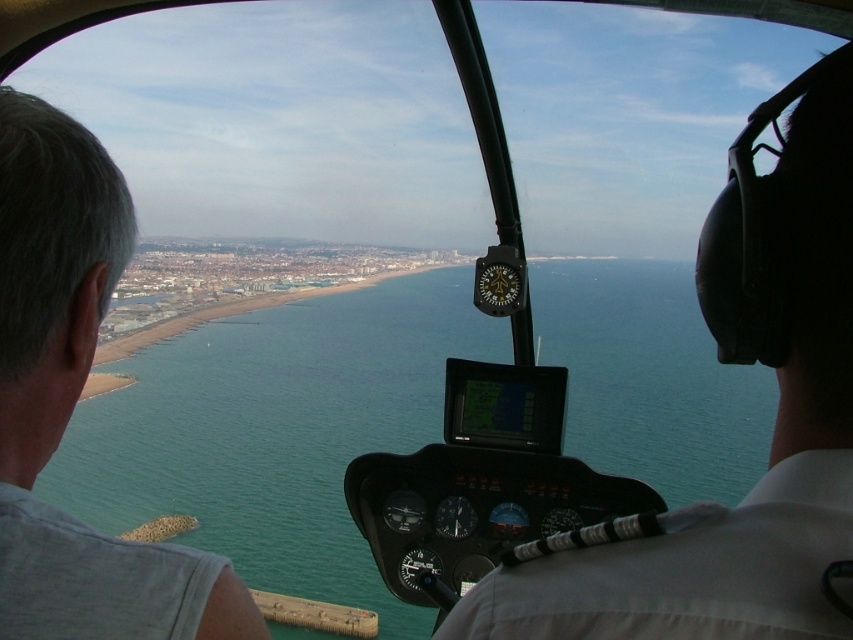
Question: Is white fabric at upper right further to camera compared to gray hair at left?

Choices:
 (A) yes
 (B) no

Answer: (B)

Question: Is white fabric at upper right thinner than gray hair at left?

Choices:
 (A) no
 (B) yes

Answer: (A)

Question: Which of the following is the farthest from the observer?

Choices:
 (A) (795, 284)
 (B) (86, 170)

Answer: (B)

Question: Which object appears closest to the camera in this image?

Choices:
 (A) gray hair at left
 (B) white fabric at upper right

Answer: (B)

Question: Does white fabric at upper right come behind gray hair at left?

Choices:
 (A) no
 (B) yes

Answer: (A)